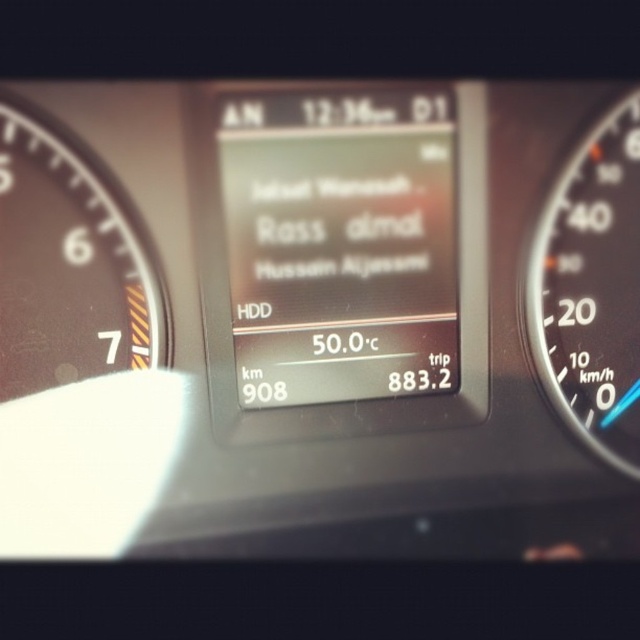
Question: Does matte black gauge at left have a smaller size compared to black plastic speedometer at right?

Choices:
 (A) yes
 (B) no

Answer: (A)

Question: Can you confirm if matte black gauge at left is positioned below black plastic speedometer at right?

Choices:
 (A) yes
 (B) no

Answer: (B)

Question: Among these objects, which one is nearest to the camera?

Choices:
 (A) black plastic speedometer at right
 (B) matte black gauge at left

Answer: (B)

Question: Does matte black gauge at left have a greater width compared to black plastic speedometer at right?

Choices:
 (A) no
 (B) yes

Answer: (B)

Question: Which object is farther from the camera taking this photo?

Choices:
 (A) matte black gauge at left
 (B) black plastic speedometer at right

Answer: (B)